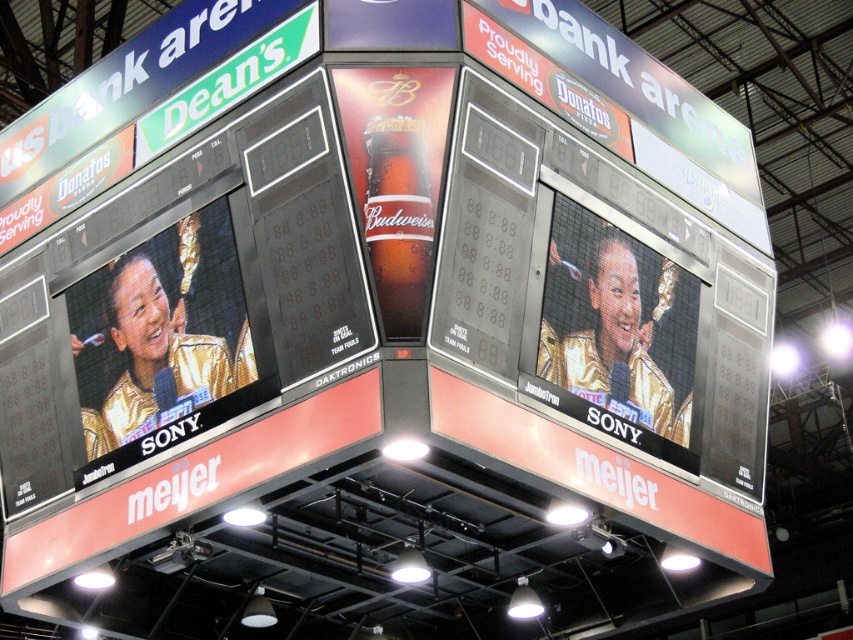
Question: Does matte black screen at left have a lesser width compared to shiny glass budweiser at center?

Choices:
 (A) no
 (B) yes

Answer: (A)

Question: Estimate the real-world distances between objects in this image. Which object is farther from the matte gold screen at right?

Choices:
 (A) matte black screen at left
 (B) green plastic sign at upper left
 (C) bottle glass at center
 (D) shiny glass budweiser at center

Answer: (B)

Question: Can you confirm if matte black screen at left is wider than bottle glass at center?

Choices:
 (A) no
 (B) yes

Answer: (B)

Question: Which of the following is the farthest from the observer?

Choices:
 (A) (219, 417)
 (B) (397, 122)

Answer: (A)

Question: Among these objects, which one is farthest from the camera?

Choices:
 (A) shiny glass budweiser at center
 (B) bottle glass at center
 (C) matte black screen at left

Answer: (C)

Question: Observing the image, what is the correct spatial positioning of matte black screen at left in reference to shiny glass budweiser at center?

Choices:
 (A) above
 (B) below

Answer: (B)